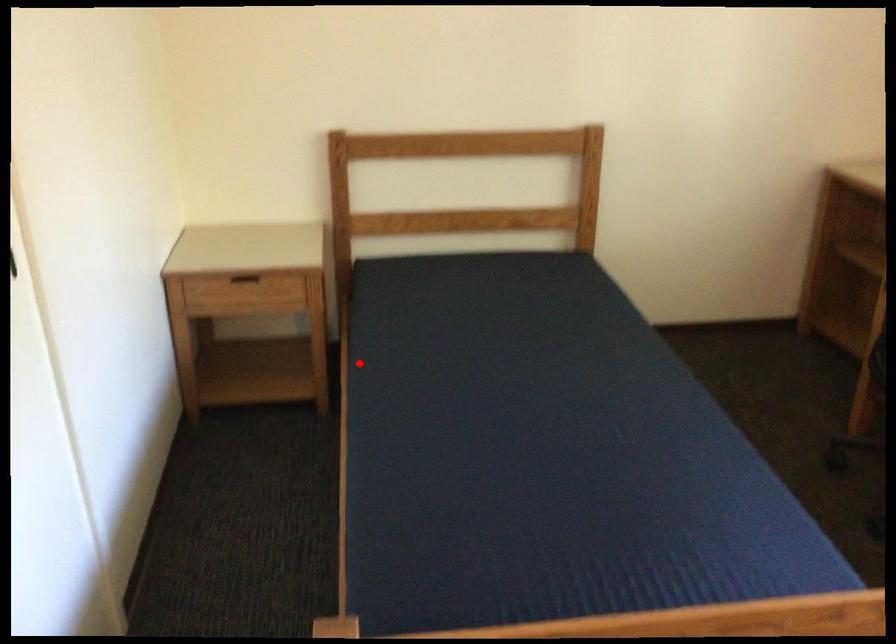
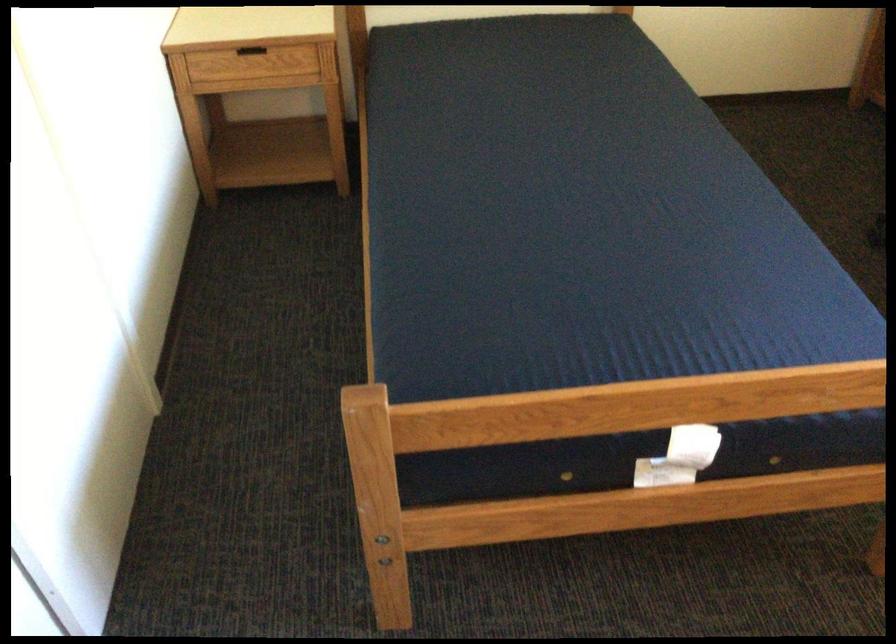
In the second image, find the point that corresponds to the highlighted location in the first image.

(378, 140)